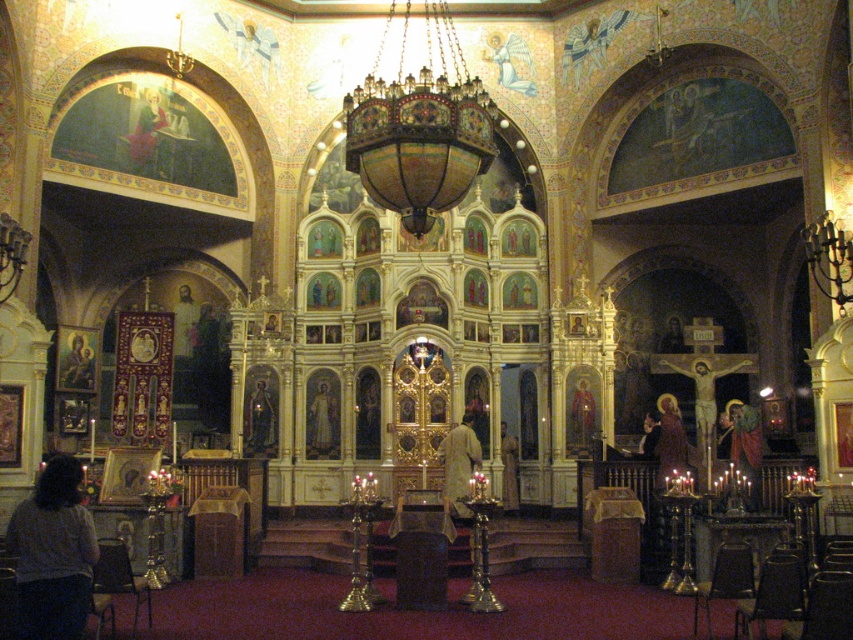
Question: Which point is farther from the camera taking this photo?

Choices:
 (A) (322, 381)
 (B) (143, 157)
 (C) (55, 580)

Answer: (A)

Question: Is light beige fabric at center further to the viewer compared to gold textured robe at right?

Choices:
 (A) no
 (B) yes

Answer: (A)

Question: Which object is closer to the camera taking this photo?

Choices:
 (A) matte gold icon at upper left
 (B) gold textured icon at center
 (C) gold leaf icon at center
 (D) gold textured robe at right

Answer: (D)

Question: Can you confirm if light beige fabric at center is thinner than matte gold icon at upper left?

Choices:
 (A) no
 (B) yes

Answer: (A)

Question: Does light beige fabric at center have a smaller size compared to golden robe at center?

Choices:
 (A) no
 (B) yes

Answer: (B)

Question: Which point appears closest to the camera in this image?

Choices:
 (A) pos(463,508)
 (B) pos(248,440)
 (C) pos(587,380)
 (D) pos(670,458)

Answer: (A)